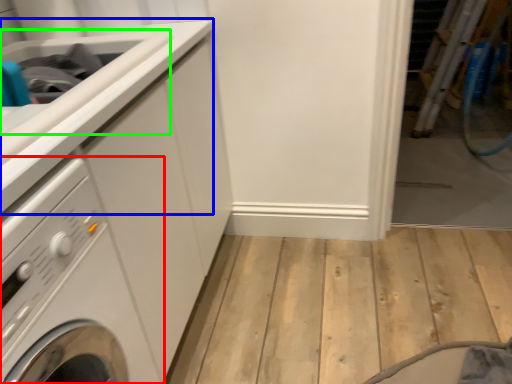
Question: Which object is positioned farthest from washing machine (highlighted by a red box)? Select from counter top (highlighted by a blue box) and sink (highlighted by a green box).

Choices:
 (A) counter top
 (B) sink

Answer: (B)